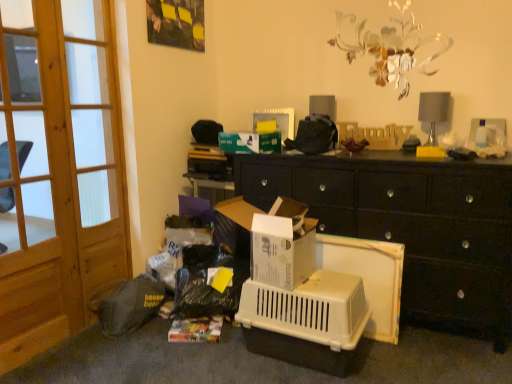
Question: Can you confirm if wooden screen door at left, the first screen door positioned from the right, is wider than white cardboard box at center?

Choices:
 (A) no
 (B) yes

Answer: (A)

Question: From a real-world perspective, does wooden screen door at left, the first screen door positioned from the right, sit lower than white cardboard box at center?

Choices:
 (A) no
 (B) yes

Answer: (A)

Question: From the image's perspective, is wooden screen door at left, the first screen door positioned from the right, on top of white cardboard box at center?

Choices:
 (A) yes
 (B) no

Answer: (A)

Question: Is wooden screen door at left, the first screen door positioned from the right, aimed at white cardboard box at center?

Choices:
 (A) no
 (B) yes

Answer: (B)

Question: Is wooden screen door at left, the first screen door positioned from the right, located outside white cardboard box at center?

Choices:
 (A) yes
 (B) no

Answer: (A)

Question: Relative to wooden screen door at left, which is the 1th screen door in left-to-right order, is wooden screen door at left, which is counted as the second screen door, starting from the left, in front or behind?

Choices:
 (A) behind
 (B) front

Answer: (A)

Question: Is wooden screen door at left, the first screen door positioned from the right, bigger or smaller than wooden screen door at left, which is the 1th screen door in left-to-right order?

Choices:
 (A) big
 (B) small

Answer: (B)

Question: Is wooden screen door at left, which is counted as the second screen door, starting from the left, taller or shorter than wooden screen door at left, which ranks as the 2th screen door in right-to-left order?

Choices:
 (A) tall
 (B) short

Answer: (A)

Question: Is wooden screen door at left, the first screen door positioned from the right, to the left or to the right of wooden screen door at left, which is the 1th screen door in left-to-right order, in the image?

Choices:
 (A) right
 (B) left

Answer: (A)

Question: Is point (226, 201) positioned closer to the camera than point (96, 140)?

Choices:
 (A) farther
 (B) closer

Answer: (B)

Question: Would you say white cardboard box at center is inside or outside wooden screen door at left, which is counted as the second screen door, starting from the left?

Choices:
 (A) inside
 (B) outside

Answer: (B)

Question: Is white cardboard box at center taller or shorter than wooden screen door at left, the first screen door positioned from the right?

Choices:
 (A) short
 (B) tall

Answer: (A)

Question: From the image's perspective, is white cardboard box at center positioned above or below wooden screen door at left, which is counted as the second screen door, starting from the left?

Choices:
 (A) below
 (B) above

Answer: (A)

Question: Would you say wooden screen door at left, which is the 1th screen door in left-to-right order, is inside or outside wooden screen door at left, the first screen door positioned from the right?

Choices:
 (A) outside
 (B) inside

Answer: (A)

Question: Considering their positions, is wooden screen door at left, which is the 1th screen door in left-to-right order, located in front of or behind wooden screen door at left, the first screen door positioned from the right?

Choices:
 (A) front
 (B) behind

Answer: (A)